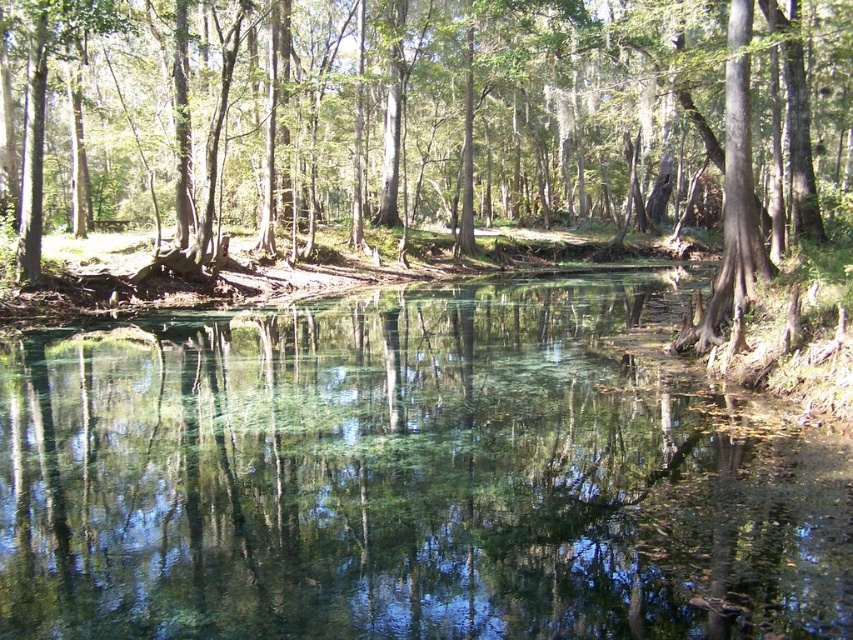
Question: Can you confirm if clear glass lake at center is smaller than green leafy tree at center?

Choices:
 (A) yes
 (B) no

Answer: (A)

Question: Does clear glass lake at center appear over green leafy tree at center?

Choices:
 (A) no
 (B) yes

Answer: (A)

Question: Does clear glass lake at center appear on the left side of green leafy tree at center?

Choices:
 (A) no
 (B) yes

Answer: (B)

Question: Which of the following is the closest to the observer?

Choices:
 (A) (492, 572)
 (B) (837, 104)

Answer: (A)